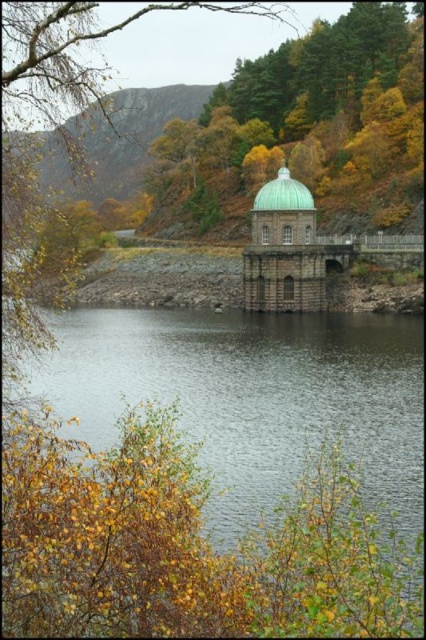
Question: Does transparent water at center have a smaller size compared to green matte dome at center?

Choices:
 (A) yes
 (B) no

Answer: (A)

Question: Which object is the farthest from the transparent water at center?

Choices:
 (A) green polished dome at center
 (B) green matte dome at center

Answer: (B)

Question: Is transparent water at center further to camera compared to green matte dome at center?

Choices:
 (A) no
 (B) yes

Answer: (A)

Question: Is transparent water at center thinner than green polished dome at center?

Choices:
 (A) no
 (B) yes

Answer: (A)

Question: Estimate the real-world distances between objects in this image. Which object is closer to the transparent water at center?

Choices:
 (A) green matte dome at center
 (B) green polished dome at center

Answer: (B)

Question: Which point is closer to the camera?

Choices:
 (A) green matte dome at center
 (B) transparent water at center
 (C) green polished dome at center

Answer: (B)